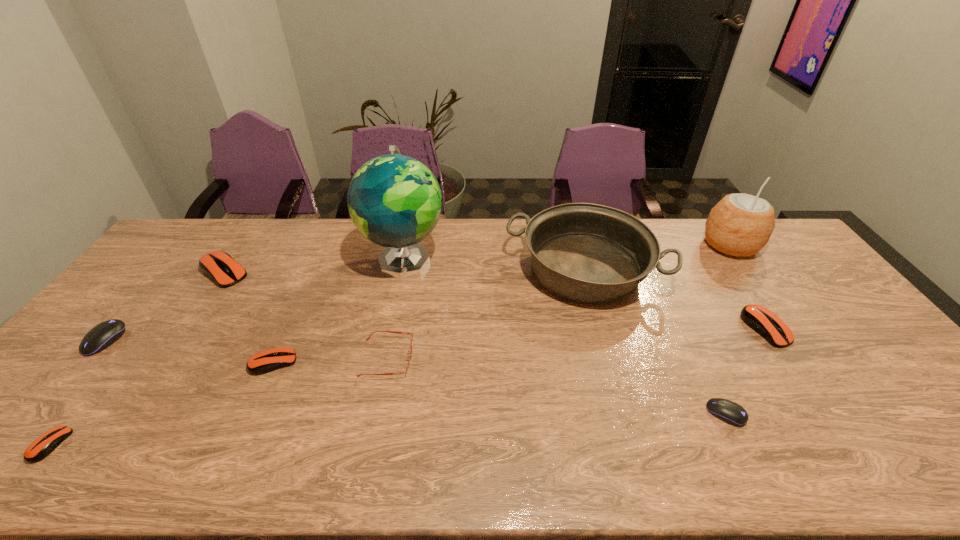
The width and height of the screenshot is (960, 540). I want to click on blue globe, so click(x=395, y=201).

At what (x,y) coordinates should I click in order to perform the action: click on the tallest object. Please return your answer as a coordinate pair (x, y). Image resolution: width=960 pixels, height=540 pixels. Looking at the image, I should click on (395, 201).

Image resolution: width=960 pixels, height=540 pixels. Find the location of `coconut`. coconut is located at coordinates (740, 225).

I want to click on pan, so click(591, 253).

Find the location of `the biggest orange computer mouse`. the biggest orange computer mouse is located at coordinates (219, 266).

The image size is (960, 540). What are the coordinates of `the second orange computer mouse from left to right` in the screenshot? It's located at (219, 266).

You are a GUI agent. You are given a task and a screenshot of the screen. Output one action in this format:
    pyautogui.click(x=<x>, y=<y>)
    Task: Click on the third smallest orange computer mouse
    The width and height of the screenshot is (960, 540).
    Given the screenshot: What is the action you would take?
    pyautogui.click(x=760, y=319)

The image size is (960, 540). I want to click on the second farthest orange computer mouse, so click(760, 319).

Image resolution: width=960 pixels, height=540 pixels. I want to click on the leftmost object, so click(x=103, y=335).

This screenshot has width=960, height=540. I want to click on the farther black computer mouse, so click(x=103, y=335).